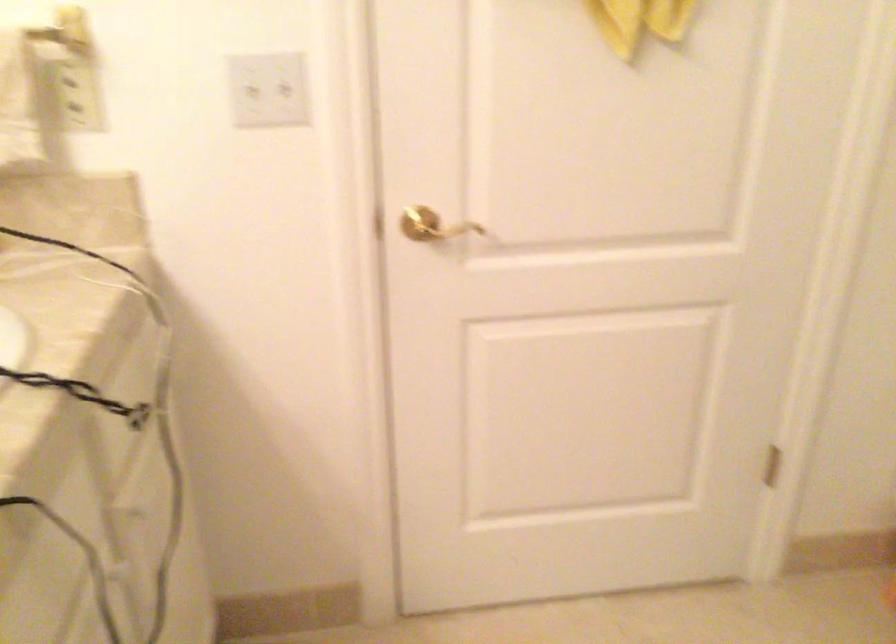
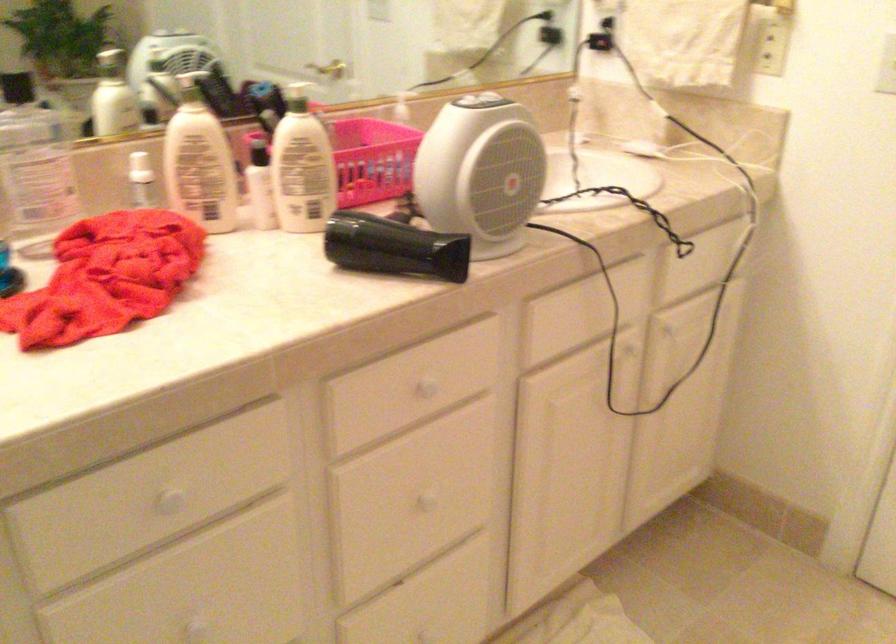
Locate, in the second image, the point that corresponds to pixel 85 86 in the first image.

(771, 46)